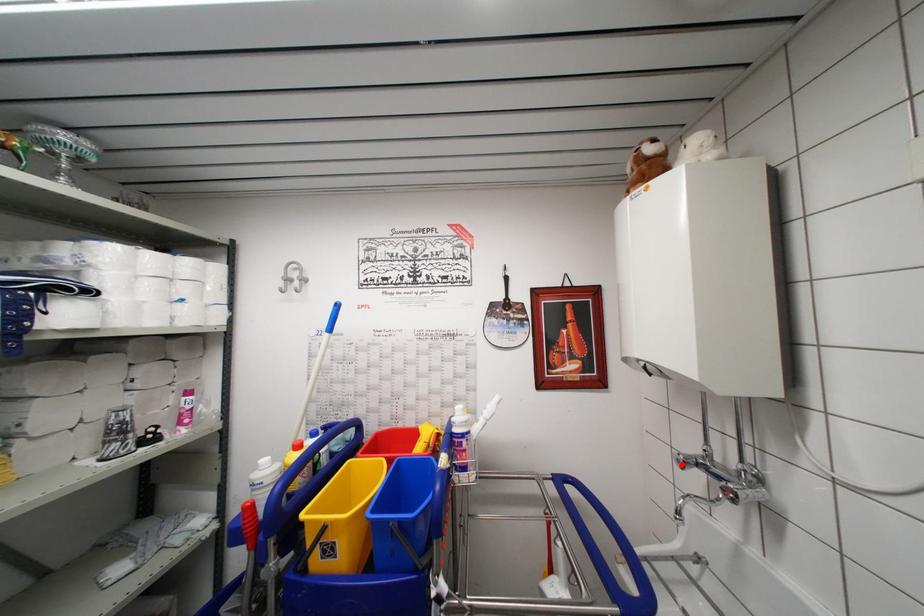
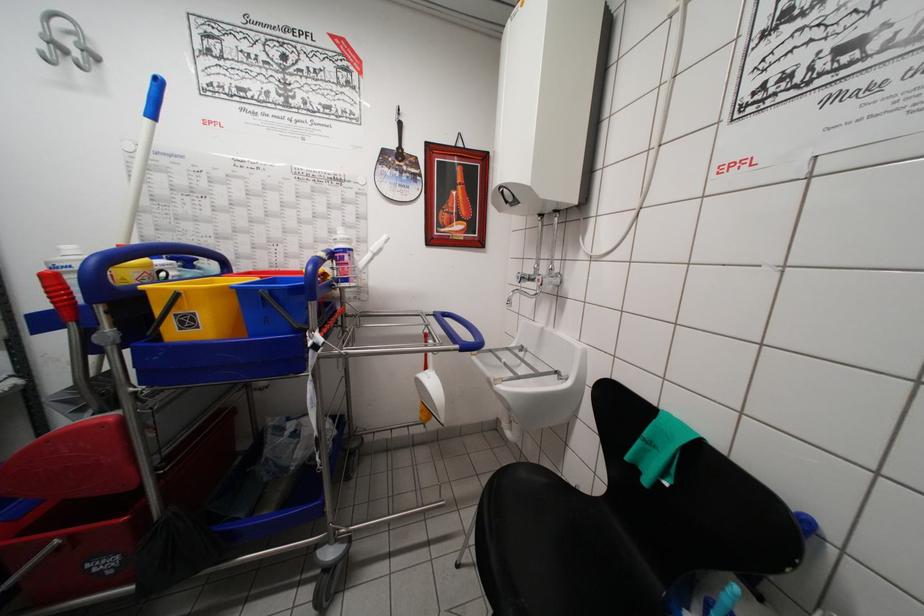
In the second image, find the point that corresponds to the highlighted location in the first image.

(521, 282)